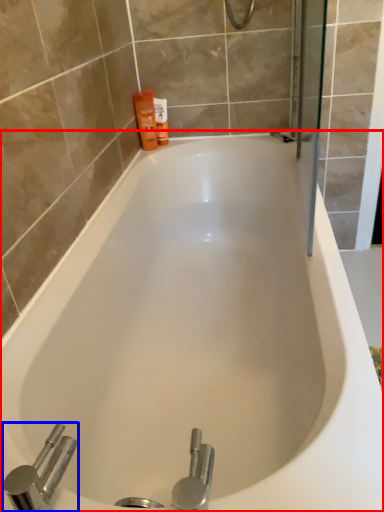
Question: Which point is closer to the camera, bathtub (highlighted by a red box) or tap (highlighted by a blue box)?

Choices:
 (A) bathtub
 (B) tap

Answer: (B)